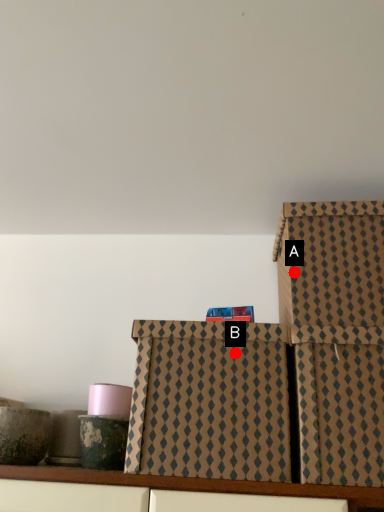
Question: Two points are circled on the image, labeled by A and B beside each circle. Among these points, which one is nearest to the camera?

Choices:
 (A) A is closer
 (B) B is closer

Answer: (B)